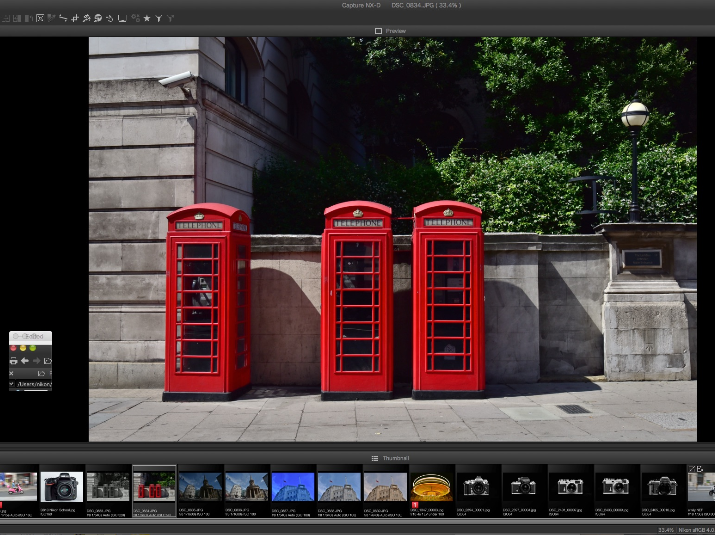
Locate an element on the screen. The image size is (715, 535). light is located at coordinates (628, 116).